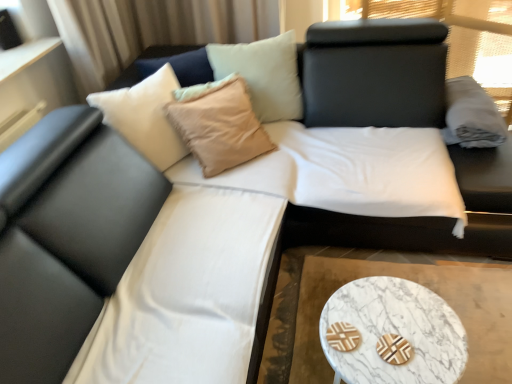
Question: Is beige fabric pillow at upper center positioned far away from black leather bed at center?

Choices:
 (A) no
 (B) yes

Answer: (A)

Question: Is beige fabric pillow at upper center closer to the viewer compared to black leather bed at center?

Choices:
 (A) yes
 (B) no

Answer: (B)

Question: Is beige fabric pillow at upper center behind black leather bed at center?

Choices:
 (A) yes
 (B) no

Answer: (A)

Question: Is beige fabric pillow at upper center aimed at black leather bed at center?

Choices:
 (A) no
 (B) yes

Answer: (B)

Question: Does beige fabric pillow at upper center have a larger size compared to black leather bed at center?

Choices:
 (A) no
 (B) yes

Answer: (A)

Question: From a real-world perspective, is beige fabric pillow at upper center physically above black leather bed at center?

Choices:
 (A) no
 (B) yes

Answer: (B)

Question: Considering the relative sizes of gray cotton pillow at upper right and white marble cocktail table at lower right in the image provided, is gray cotton pillow at upper right wider than white marble cocktail table at lower right?

Choices:
 (A) no
 (B) yes

Answer: (A)

Question: Is gray cotton pillow at upper right with white marble cocktail table at lower right?

Choices:
 (A) yes
 (B) no

Answer: (B)

Question: Does gray cotton pillow at upper right have a lesser height compared to white marble cocktail table at lower right?

Choices:
 (A) no
 (B) yes

Answer: (A)

Question: Is the position of gray cotton pillow at upper right less distant than that of white marble cocktail table at lower right?

Choices:
 (A) yes
 (B) no

Answer: (B)

Question: From a real-world perspective, is gray cotton pillow at upper right under white marble cocktail table at lower right?

Choices:
 (A) no
 (B) yes

Answer: (A)

Question: Is gray cotton pillow at upper right taller than white marble cocktail table at lower right?

Choices:
 (A) no
 (B) yes

Answer: (B)

Question: From the image's perspective, does black leather bed at center appear higher than marble/stone coffee table at lower right?

Choices:
 (A) no
 (B) yes

Answer: (B)